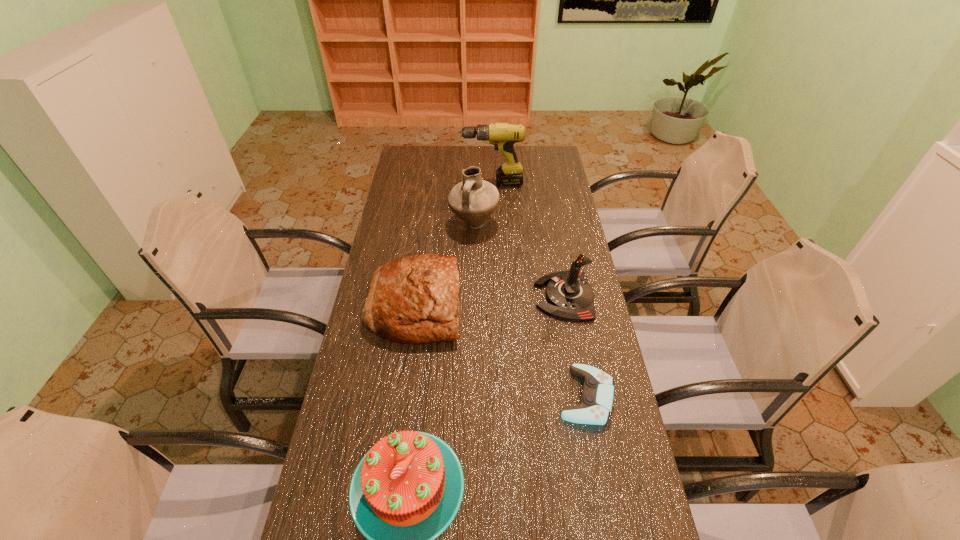
I want to click on vacant region at the right edge, so click(x=626, y=505).

Locate an element on the screen. The width and height of the screenshot is (960, 540). free location at the far left corner of the desktop is located at coordinates (413, 167).

The width and height of the screenshot is (960, 540). I want to click on free location at the far right corner, so click(x=544, y=154).

Where is `free spot between the drill and the joystick`? free spot between the drill and the joystick is located at coordinates (528, 240).

This screenshot has height=540, width=960. Find the location of `empty space that is in between the joystick and the control`. empty space that is in between the joystick and the control is located at coordinates (575, 346).

At what (x,y) coordinates should I click in order to perform the action: click on vacant area that lies between the joystick and the bread. Please return your answer as a coordinate pair (x, y). Image resolution: width=960 pixels, height=540 pixels. Looking at the image, I should click on (490, 301).

What are the coordinates of `vacant space that is in between the fifth farthest object and the joystick` in the screenshot? It's located at tap(575, 346).

Locate an element on the screen. This screenshot has height=540, width=960. free space between the farthest object and the joystick is located at coordinates (528, 240).

Where is `unoccupied area between the pitcher and the joystick`? This screenshot has width=960, height=540. unoccupied area between the pitcher and the joystick is located at coordinates (519, 260).

Locate an element on the screen. This screenshot has width=960, height=540. object that is the third closest to the pitcher is located at coordinates (570, 297).